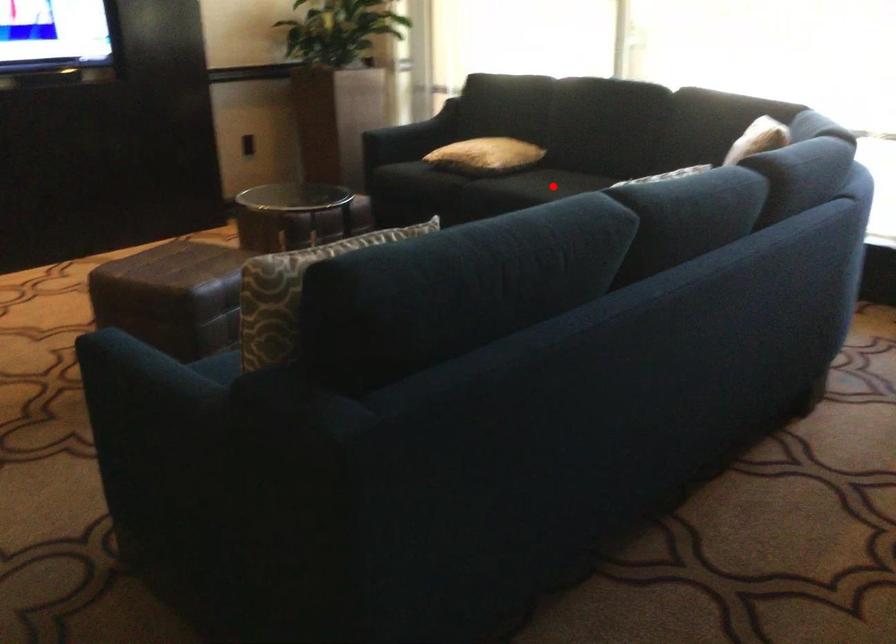
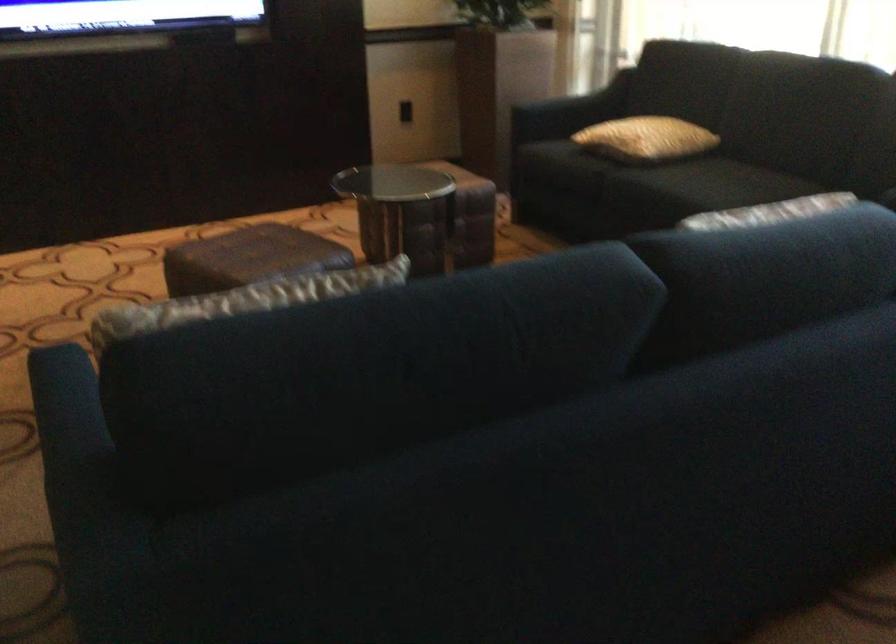
Question: A red point is marked in image1. In image2, is the corresponding 3D point closer to the camera or farther? Reply with the corresponding letter.

Choices:
 (A) The corresponding 3D point is closer.
 (B) The corresponding 3D point is farther.

Answer: (A)